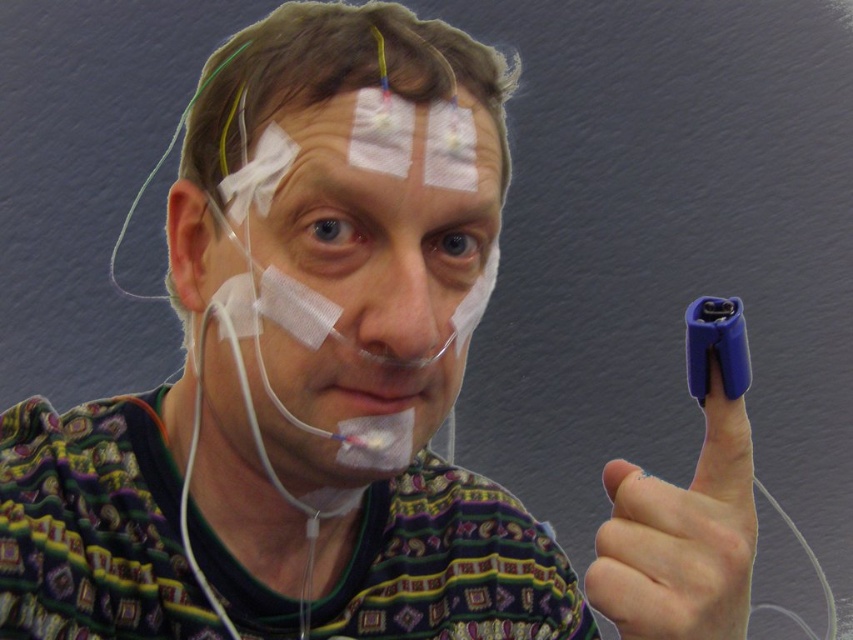
Based on the scene description, which object is positioned lower on the person, the white matte bandage at center or the white adhesive tape at upper center?

The white matte bandage at center is located below the white adhesive tape at upper center, so it is positioned lower on the person.

You are a medical technician who needs to place a new sensor between the purple rubber finger at upper right and the white adhesive tape at upper center. The sensor requires a minimum of 5 inches of space to function properly. Based on the scene, can the sensor be placed between them?

The purple rubber finger at upper right and the white adhesive tape at upper center are 5.87 inches apart from each other. Since the required minimum space is 5 inches, the sensor can be placed between them as the distance is sufficient.

You are a nurse checking the medical equipment on the patient. You notice the purple rubber finger at upper right and the white adhesive tape at upper center. Which one is smaller in size?

The purple rubber finger at upper right has a smaller size compared to the white adhesive tape at upper center, so the purple rubber finger at upper right is smaller.